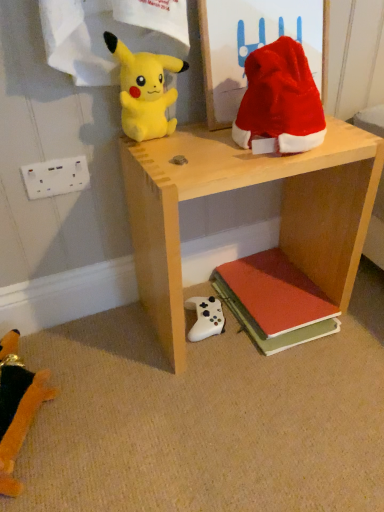
At what (x,y) coordinates should I click in order to perform the action: click on vacant area on top of red matte book at lower right (from a real-world perspective). Please return your answer as a coordinate pair (x, y). Looking at the image, I should click on (279, 282).